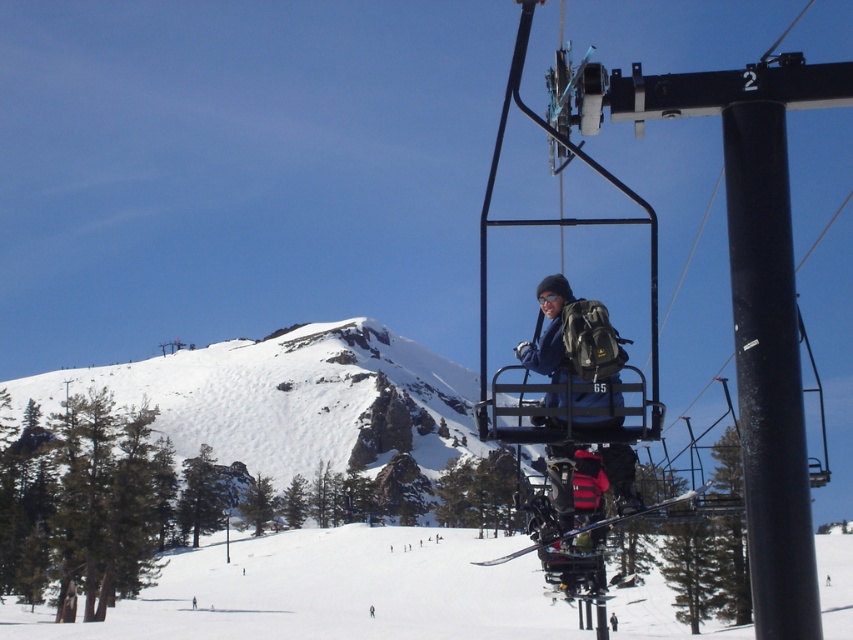
Can you confirm if white snow ski slope at center is bigger than black matte pole at center right?

Correct, white snow ski slope at center is larger in size than black matte pole at center right.

Can you confirm if white snow ski slope at center is positioned below black matte pole at center right?

Yes.

Find the location of a particular element. This screenshot has height=640, width=853. white snow ski slope at center is located at coordinates (329, 589).

Does black matte pole at center right have a larger size compared to matte blue jacket at center?

No, black matte pole at center right is not bigger than matte blue jacket at center.

In the scene shown: Can you confirm if black matte pole at center right is taller than matte blue jacket at center?

Indeed, black matte pole at center right has a greater height compared to matte blue jacket at center.

Is point (746, 412) behind point (619, 474)?

No, (746, 412) is closer to viewer.

Identify the location of black matte pole at center right. This screenshot has width=853, height=640. [769, 372].

Identify the location of white snow ski slope at center. The width and height of the screenshot is (853, 640). (329, 589).

Can you confirm if white snow ski slope at center is positioned to the right of matte blue jacket at center?

Incorrect, white snow ski slope at center is not on the right side of matte blue jacket at center.

The image size is (853, 640). I want to click on white snow ski slope at center, so click(329, 589).